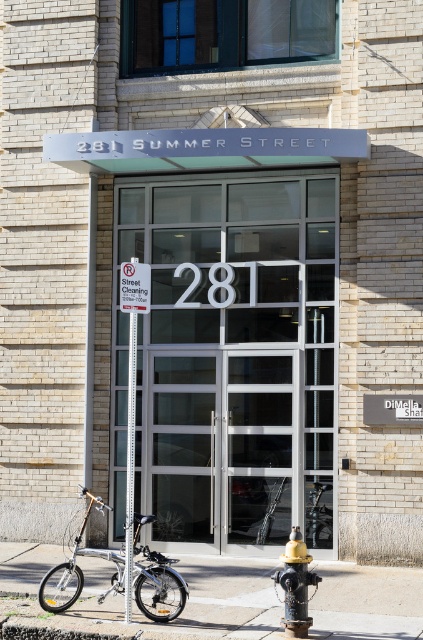
Can you confirm if transparent glass door at center is wider than metallic street sign at center?

Yes, transparent glass door at center is wider than metallic street sign at center.

Between transparent glass door at center and metallic street sign at center, which one appears on the left side from the viewer's perspective?

metallic street sign at center is more to the left.

Identify the location of transparent glass door at center. (230, 358).

Locate an element on the screen. Image resolution: width=423 pixels, height=640 pixels. transparent glass door at center is located at coordinates (230, 358).

How distant is silver metallic bicycle at lower left from white paper sign at upper center?

silver metallic bicycle at lower left and white paper sign at upper center are 6.24 feet apart from each other.

Is the position of silver metallic bicycle at lower left less distant than that of white paper sign at upper center?

Yes.

This screenshot has width=423, height=640. Describe the element at coordinates (156, 580) in the screenshot. I see `silver metallic bicycle at lower left` at that location.

Where is `silver metallic bicycle at lower left`? The image size is (423, 640). silver metallic bicycle at lower left is located at coordinates (156, 580).

Can you confirm if concrete sidewalk at lower center is shorter than black cast iron fire hydrant at lower center?

Yes, concrete sidewalk at lower center is shorter than black cast iron fire hydrant at lower center.

Which is in front, point (365, 630) or point (288, 596)?

Point (288, 596) is more forward.

I want to click on concrete sidewalk at lower center, so click(367, 602).